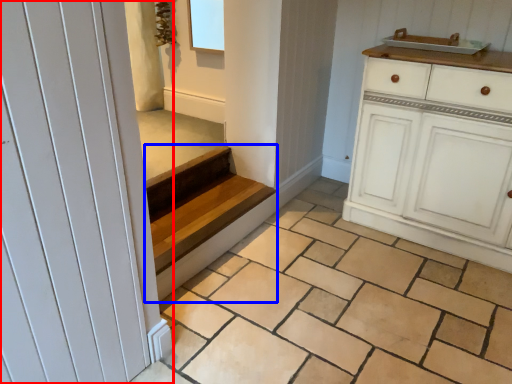
Question: Among these objects, which one is farthest to the camera, door (highlighted by a red box) or stairs (highlighted by a blue box)?

Choices:
 (A) door
 (B) stairs

Answer: (B)